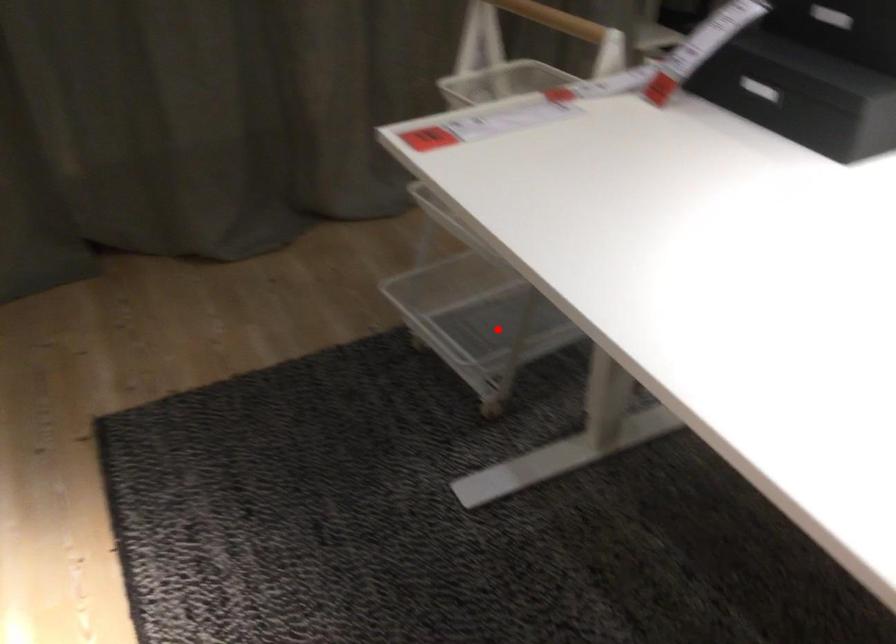
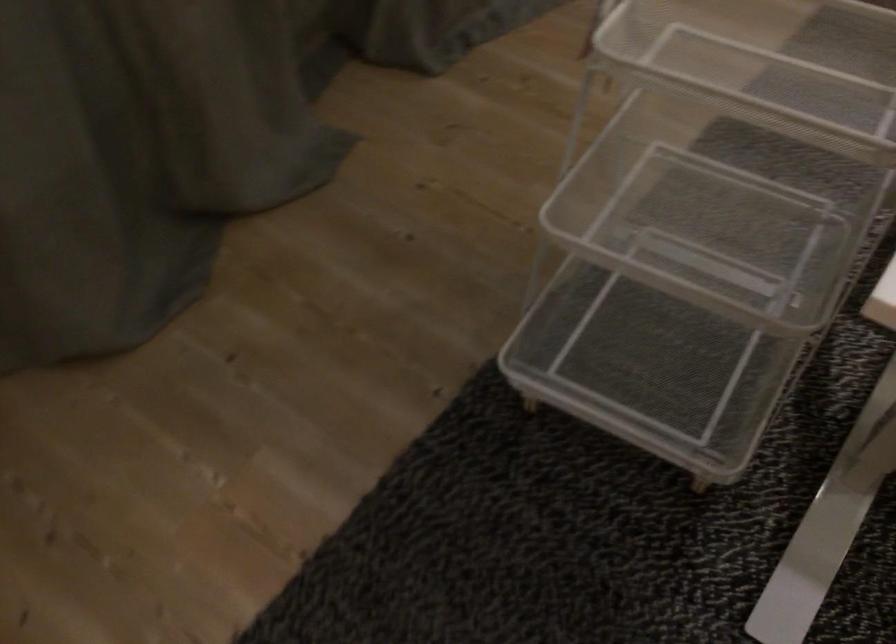
Question: I am providing you with two images of the same scene from different viewpoints. Given a red point in image1, look at the same physical point in image2. Is it:

Choices:
 (A) Closer to the viewpoint
 (B) Farther from the viewpoint

Answer: (A)